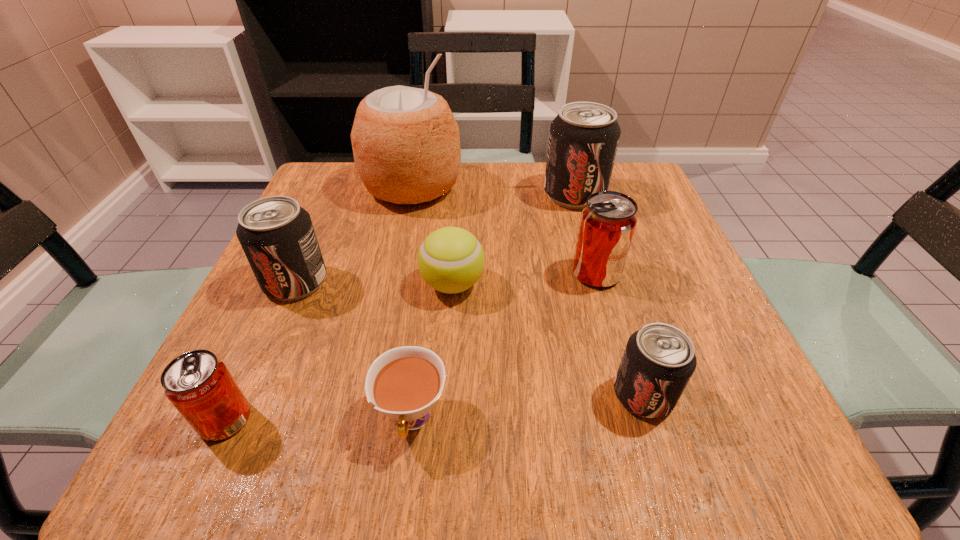
You are a GUI agent. You are given a task and a screenshot of the screen. Output one action in this format:
    pyautogui.click(x=<x>, y=<y>)
    Task: Click on the smaller red pop soda
    
    Given the screenshot: What is the action you would take?
    pyautogui.click(x=199, y=385)

Locate an element on the screen. teacup is located at coordinates (405, 382).

Locate an element on the screen. This screenshot has width=960, height=540. the shortest object is located at coordinates (405, 382).

I want to click on vacant region located 0.400m on the right of the coconut, so click(x=629, y=187).

Where is `vacant space located 0.070m on the right of the farthest pop soda`? vacant space located 0.070m on the right of the farthest pop soda is located at coordinates (636, 194).

Image resolution: width=960 pixels, height=540 pixels. In order to click on blank area located 0.330m on the back of the farther red pop soda in this screenshot , I will do `click(567, 172)`.

You are a GUI agent. You are given a task and a screenshot of the screen. Output one action in this format:
    pyautogui.click(x=<x>, y=<y>)
    Task: Click on the free spot located 0.310m on the back of the leftmost black soda can
    The height and width of the screenshot is (540, 960).
    Given the screenshot: What is the action you would take?
    pyautogui.click(x=341, y=179)

The height and width of the screenshot is (540, 960). Identify the location of vacant space positioned 0.150m on the front of the green tennis ball. (446, 381).

Find the location of a particular element. The height and width of the screenshot is (540, 960). free space located 0.370m on the left of the smallest black soda can is located at coordinates (359, 395).

The width and height of the screenshot is (960, 540). What are the coordinates of `vacant space located 0.260m on the back of the nearer red pop soda` in the screenshot? It's located at (292, 276).